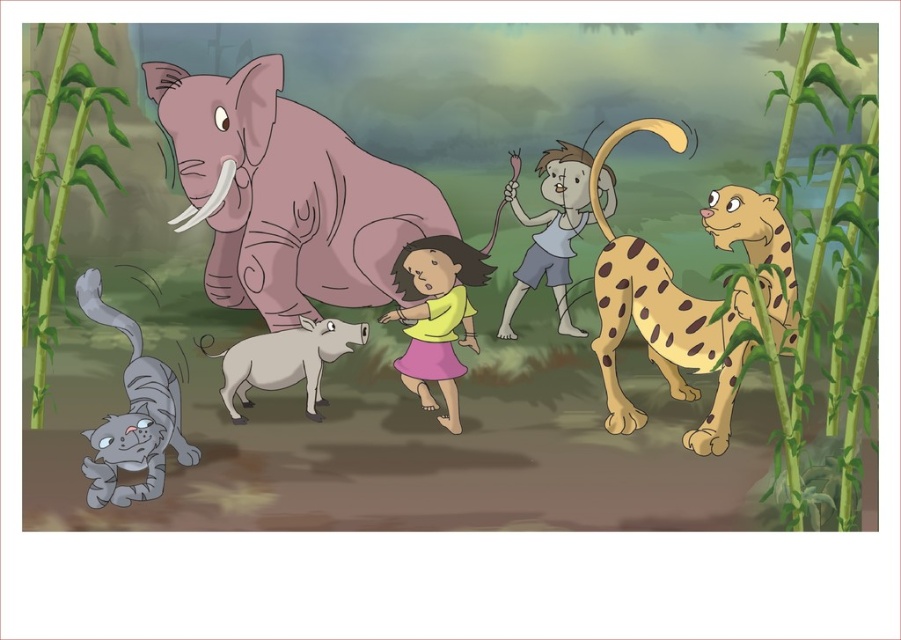
Question: Which object appears closest to the camera in this image?

Choices:
 (A) gray furry cat at lower left
 (B) spotted fur leopard at right
 (C) white cotton shirt at center
 (D) pink matte elephant at center

Answer: (B)

Question: Can you confirm if spotted fur leopard at right is positioned below gray furry cat at lower left?

Choices:
 (A) yes
 (B) no

Answer: (B)

Question: Which object is closer to the camera taking this photo?

Choices:
 (A) spotted fur leopard at right
 (B) pink matte elephant at center
 (C) yellow matte dress at center
 (D) white matte goat at center

Answer: (A)

Question: Is pink matte elephant at center closer to camera compared to yellow matte dress at center?

Choices:
 (A) no
 (B) yes

Answer: (B)

Question: Is the position of gray furry cat at lower left less distant than that of white matte goat at center?

Choices:
 (A) no
 (B) yes

Answer: (B)

Question: Which is farther from the spotted fur leopard at right?

Choices:
 (A) white matte goat at center
 (B) gray furry cat at lower left

Answer: (B)